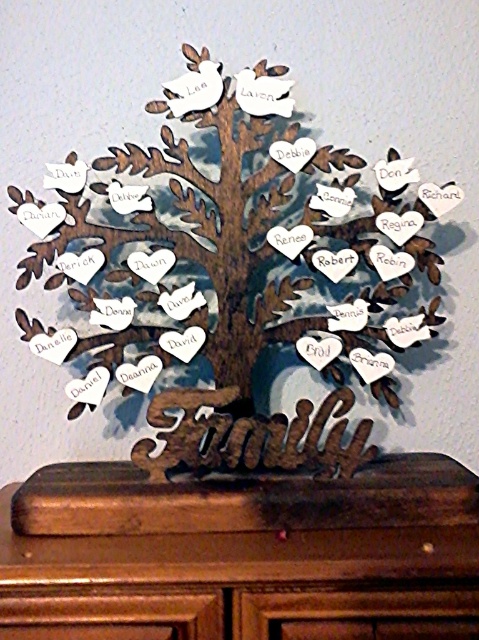
Is wooden family tree at center below brown wood dresser at lower center?

No, wooden family tree at center is not below brown wood dresser at lower center.

Between point (228, 428) and point (374, 604), which one is positioned in front?

Point (374, 604)

This screenshot has width=479, height=640. What are the coordinates of `wooden family tree at center` in the screenshot? It's located at (235, 280).